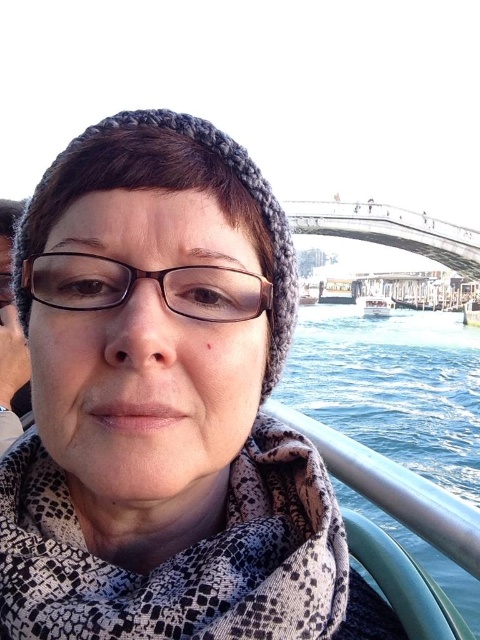
You are a photographer trying to capture a clear shot of the brown matte glasses at center and the white plastic boat at center. Based on their positions, which object should you focus on first to ensure both are in sharp focus?

The brown matte glasses at center is closer to the viewer than the white plastic boat at center. To ensure both are in sharp focus, you should focus on the brown matte glasses at center first, as it is the closer object, and adjust the depth of field accordingly.

You are a photographer trying to capture a detailed shot of two specific points in the scene. The first point is at coordinates point(345, 291) and the second is at point(386, 301). Based on their positions, which point is closer to the camera lens?

Point(345, 291) is closer to the camera lens because it is further to the viewer than point(386, 301).

You are a photographer trying to capture the scenic view of the bridge and river from the white plastic boat at center. However, you notice the brown matte glasses at center might block your shot. Based on their positions, can you determine if the glasses are in the way of the view towards the bridge?

The brown matte glasses at center are to the left of the white plastic boat at center, so they are positioned away from the direction of the bridge. Therefore, the glasses are not blocking the view towards the bridge.